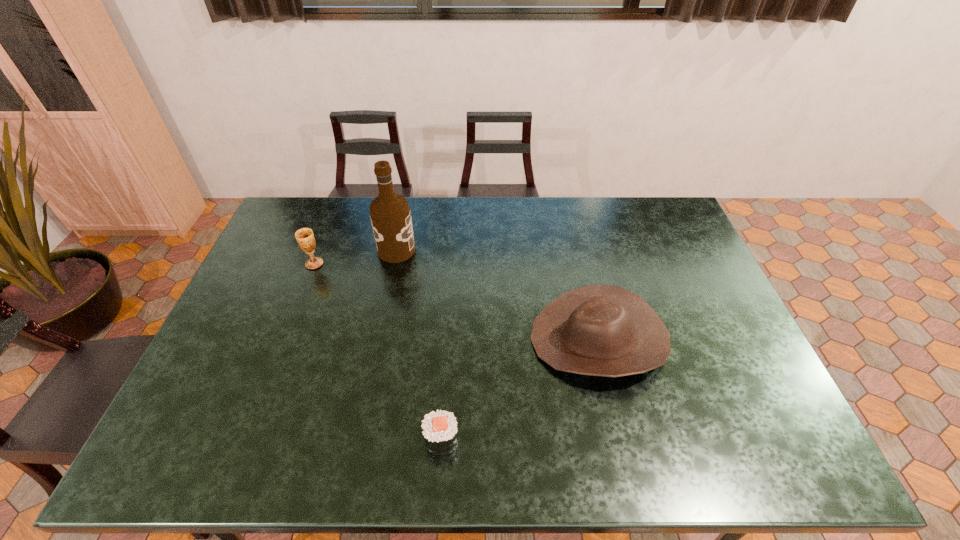
Identify the location of free space between the second nearest object and the chalice. (456, 302).

Identify the location of empty space that is in between the chalice and the alcohol. This screenshot has width=960, height=540. (355, 257).

This screenshot has height=540, width=960. In order to click on vacant area that lies between the second object from right to left and the rightmost object in this screenshot , I will do `click(519, 389)`.

This screenshot has height=540, width=960. I want to click on unoccupied area between the tallest object and the rightmost object, so click(497, 295).

The width and height of the screenshot is (960, 540). What are the coordinates of `free point between the cowboy hat and the chalice` in the screenshot? It's located at (456, 302).

What are the coordinates of `free spot between the leftmost object and the alcohol` in the screenshot? It's located at (355, 257).

Identify the location of vacant area that lies between the leftmost object and the third farthest object. (456, 302).

Where is `free area in between the alcohol and the second nearest object`? free area in between the alcohol and the second nearest object is located at coordinates (497, 295).

Identify the location of free space between the tallest object and the nearest object. The height and width of the screenshot is (540, 960). click(x=419, y=345).

Image resolution: width=960 pixels, height=540 pixels. Find the location of `the second closest object to the tallest object`. the second closest object to the tallest object is located at coordinates (602, 330).